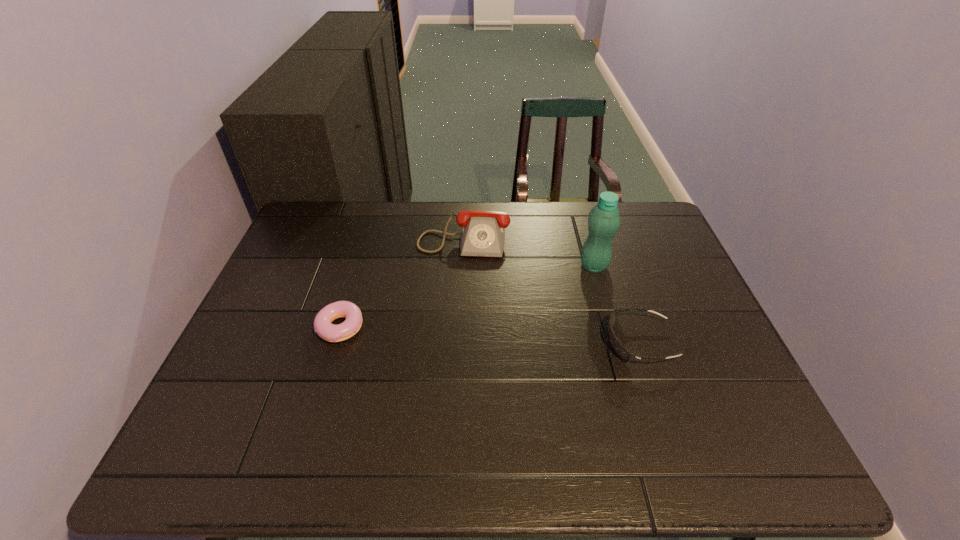
This screenshot has width=960, height=540. In order to click on doughnut in this screenshot , I will do `click(322, 324)`.

Find the location of a particular element. This screenshot has width=960, height=540. the leftmost object is located at coordinates (322, 324).

This screenshot has width=960, height=540. Find the location of `goggles`. goggles is located at coordinates coord(616,345).

Identify the location of water bottle. The height and width of the screenshot is (540, 960). (604, 219).

You are a GUI agent. You are given a task and a screenshot of the screen. Output one action in this format:
    pyautogui.click(x=<x>, y=<y>)
    Task: Click on the second object from left to right
    The height and width of the screenshot is (540, 960).
    Given the screenshot: What is the action you would take?
    pyautogui.click(x=483, y=232)

You are a GUI agent. You are given a task and a screenshot of the screen. Output one action in this format:
    pyautogui.click(x=<x>, y=<y>)
    Task: Click on the second tallest object
    This screenshot has width=960, height=540.
    Given the screenshot: What is the action you would take?
    pyautogui.click(x=483, y=232)

At what (x,y) coordinates should I click in order to perform the action: click on vacant space located on the left of the shortest object. Please return your answer as a coordinate pair (x, y). The image size is (960, 540). Looking at the image, I should click on (269, 328).

What are the coordinates of `free spot located 0.400m on the lenses of the goggles` in the screenshot? It's located at (444, 342).

The height and width of the screenshot is (540, 960). Find the location of `vacant space situated 0.230m on the lenses of the goggles`. vacant space situated 0.230m on the lenses of the goggles is located at coordinates (513, 342).

I want to click on vacant space situated on the lenses of the goggles, so click(x=553, y=342).